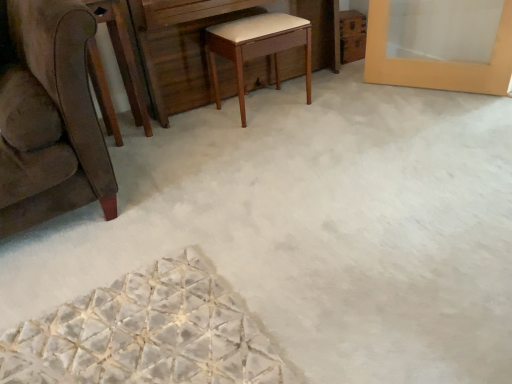
Question: Considering the relative sizes of brown wood round table at left and light brown wood stool at center in the image provided, is brown wood round table at left taller than light brown wood stool at center?

Choices:
 (A) yes
 (B) no

Answer: (A)

Question: Is brown wood round table at left aimed at light brown wood stool at center?

Choices:
 (A) yes
 (B) no

Answer: (B)

Question: Considering the relative positions of brown wood round table at left and light brown wood stool at center in the image provided, is brown wood round table at left in front of light brown wood stool at center?

Choices:
 (A) no
 (B) yes

Answer: (B)

Question: From a real-world perspective, is brown wood round table at left beneath light brown wood stool at center?

Choices:
 (A) yes
 (B) no

Answer: (B)

Question: Can you confirm if brown wood round table at left is positioned to the left of light brown wood stool at center?

Choices:
 (A) no
 (B) yes

Answer: (B)

Question: Is brown wood round table at left to the left or to the right of wooden vanity at center in the image?

Choices:
 (A) right
 (B) left

Answer: (B)

Question: Is point (93, 77) positioned closer to the camera than point (142, 54)?

Choices:
 (A) closer
 (B) farther

Answer: (A)

Question: Relative to wooden vanity at center, is brown wood round table at left in front or behind?

Choices:
 (A) behind
 (B) front

Answer: (B)

Question: Is brown wood round table at left spatially inside wooden vanity at center, or outside of it?

Choices:
 (A) inside
 (B) outside

Answer: (B)

Question: From the image's perspective, relative to brown wood round table at left, is wooden vanity at center above or below?

Choices:
 (A) above
 (B) below

Answer: (A)

Question: Considering their positions, is wooden vanity at center located in front of or behind brown wood round table at left?

Choices:
 (A) front
 (B) behind

Answer: (B)

Question: From a real-world perspective, relative to brown wood round table at left, is wooden vanity at center vertically above or below?

Choices:
 (A) above
 (B) below

Answer: (B)

Question: Is wooden vanity at center taller or shorter than brown wood round table at left?

Choices:
 (A) short
 (B) tall

Answer: (A)

Question: In the image, is light brown wood stool at center positioned in front of or behind wooden vanity at center?

Choices:
 (A) behind
 (B) front

Answer: (A)

Question: From a real-world perspective, is light brown wood stool at center physically located above or below wooden vanity at center?

Choices:
 (A) above
 (B) below

Answer: (B)